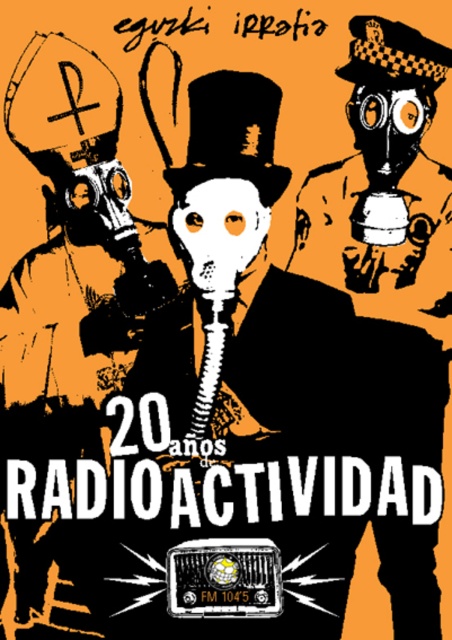
Question: Does matte black gas mask at left appear over black matte gas mask at right?

Choices:
 (A) yes
 (B) no

Answer: (B)

Question: Which point is farther from the camera taking this photo?

Choices:
 (A) (88, 97)
 (B) (362, 216)

Answer: (A)

Question: Does matte black gas mask at left appear under black matte gas mask at right?

Choices:
 (A) yes
 (B) no

Answer: (A)

Question: Can you confirm if matte black gas mask at left is positioned to the left of black matte gas mask at right?

Choices:
 (A) yes
 (B) no

Answer: (A)

Question: Which point is closer to the camera?

Choices:
 (A) matte black gas mask at left
 (B) black matte gas mask at right

Answer: (A)